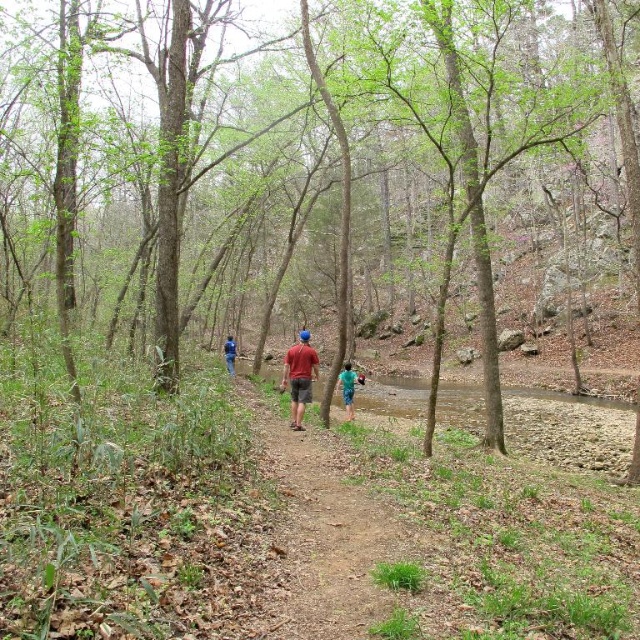
You are standing on the forest trail and see two points marked on the ground. The first point is at coordinates point [372,627] and the second point is at point [305,392]. Which point is closer to your current position?

Point [372,627] is closer to the camera than point [305,392], so the first point is closer to your current position.

You are a hiker wearing a matte red shirt at center and standing on the brown dirt path at center. You want to place a small backpack on the ground next to you. Which object has enough space to accommodate the backpack?

The matte red shirt at center has a larger size compared to the brown dirt path at center, so the backpack can be placed next to the matte red shirt at center.